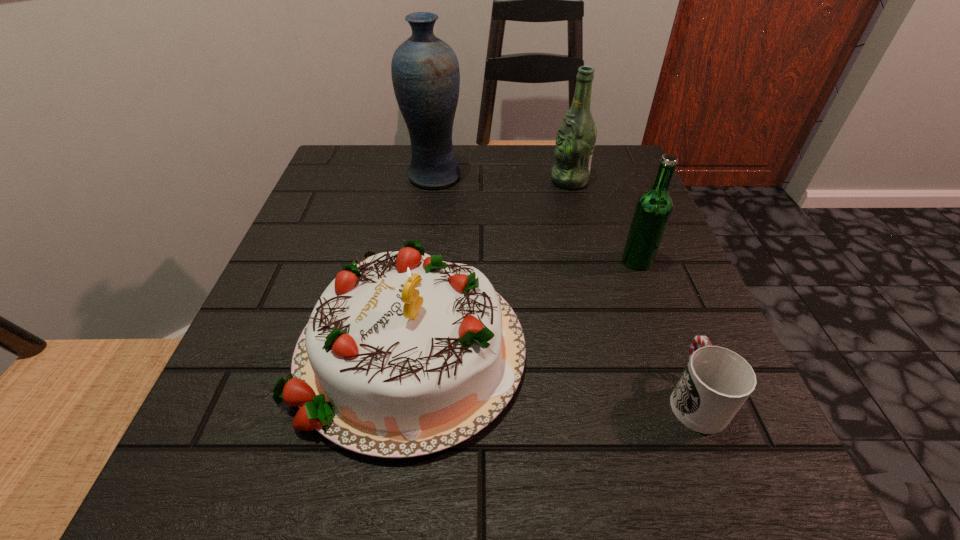
The width and height of the screenshot is (960, 540). What are the coordinates of `cup that is at the right edge` in the screenshot? It's located at (716, 382).

The image size is (960, 540). Identify the location of object present at the near left corner. (404, 355).

This screenshot has height=540, width=960. Identify the location of object that is at the far right corner. (576, 136).

Identify the location of vacant space at the far edge. The image size is (960, 540). (567, 189).

Locate an element on the screen. free space at the near edge is located at coordinates (576, 466).

You are a GUI agent. You are given a task and a screenshot of the screen. Output one action in this format:
    pyautogui.click(x=<x>, y=<y>)
    Task: Click on the free space at the left edge of the desktop
    Image resolution: width=960 pixels, height=540 pixels.
    Given the screenshot: What is the action you would take?
    pyautogui.click(x=360, y=239)

Locate an element on the screen. vacant space at the right edge is located at coordinates (660, 290).

I want to click on vacant position at the far left corner of the desktop, so tap(361, 173).

Identify the location of vacant region at the near left corner of the desktop. This screenshot has height=540, width=960. (178, 505).

Locate an element on the screen. vacant point at the near right corner is located at coordinates (687, 457).